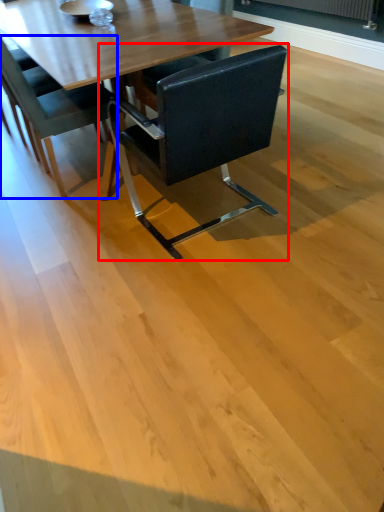
Question: Which of the following is the closest to the observer, chair (highlighted by a red box) or chair (highlighted by a blue box)?

Choices:
 (A) chair
 (B) chair

Answer: (A)